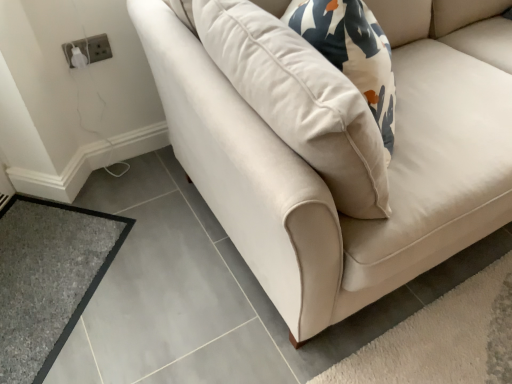
In order to click on empty space that is ontop of gray carpet at lower left in this screenshot , I will do `click(38, 268)`.